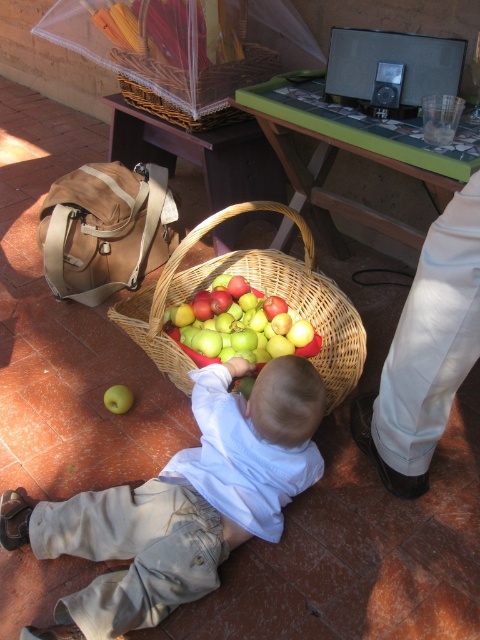
You are taking a photo of the scene and want to focus on both point (300, 461) and point (326, 326). Which point should you adjust your focus to first to ensure both are in clear view?

Point (300, 461) is closer to the camera than point (326, 326), so you should focus on point (300, 461) first to ensure both are in clear view.

You are a parent trying to ensure your child stays within a safe distance from the woven wicker basket at lower center. The safety guideline states that the child should be at least 16 inches away from the basket to prevent accidental spills. Are the white cotton pants at lower right positioned within the required safety distance?

The white cotton pants at lower right are only 15.15 inches away from the woven wicker basket at lower center, which is less than the required 16 inches. Therefore, the child is too close to the basket and does not meet the safety guideline.

You are a photographer trying to capture the child in the scene. You notice the light beige cotton pants at lower left and the green matte apple at lower left. Which object should you focus on to ensure it takes up more space in your photo?

The light beige cotton pants at lower left is larger in size than the green matte apple at lower left, so focusing on the light beige cotton pants at lower left will ensure it takes up more space in the photo.